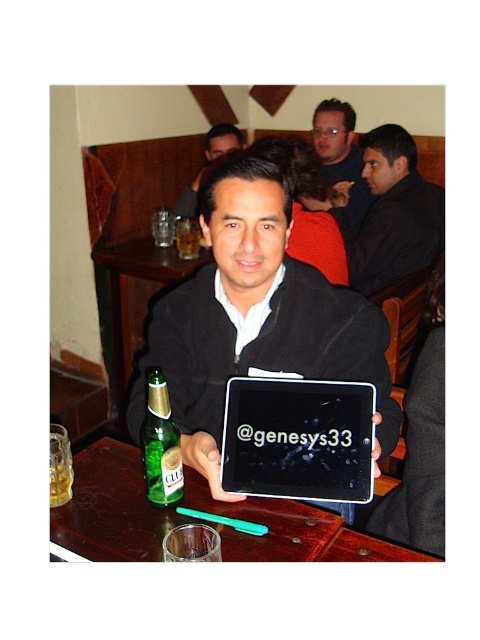
Question: Is green glass bottle at left thinner than matte black jacket at center?

Choices:
 (A) yes
 (B) no

Answer: (A)

Question: Which object is farther from the camera taking this photo?

Choices:
 (A) translucent glass at table center
 (B) brown leather table at lower left
 (C) brown wood table at center
 (D) black matte tablet at center

Answer: (A)

Question: Which object appears farthest from the camera in this image?

Choices:
 (A) translucent glass at table left
 (B) matte black shirt at upper center

Answer: (B)

Question: Which object is positioned closest to the green glass bottle at left?

Choices:
 (A) translucent glass at table center
 (B) black matte jacket at upper center
 (C) translucent glass at table left
 (D) matte black shirt at upper center

Answer: (C)

Question: Does brown wood table at center appear over black matte jacket at upper center?

Choices:
 (A) no
 (B) yes

Answer: (A)

Question: Does matte black tablet at center come behind green glass bottle at left?

Choices:
 (A) yes
 (B) no

Answer: (A)